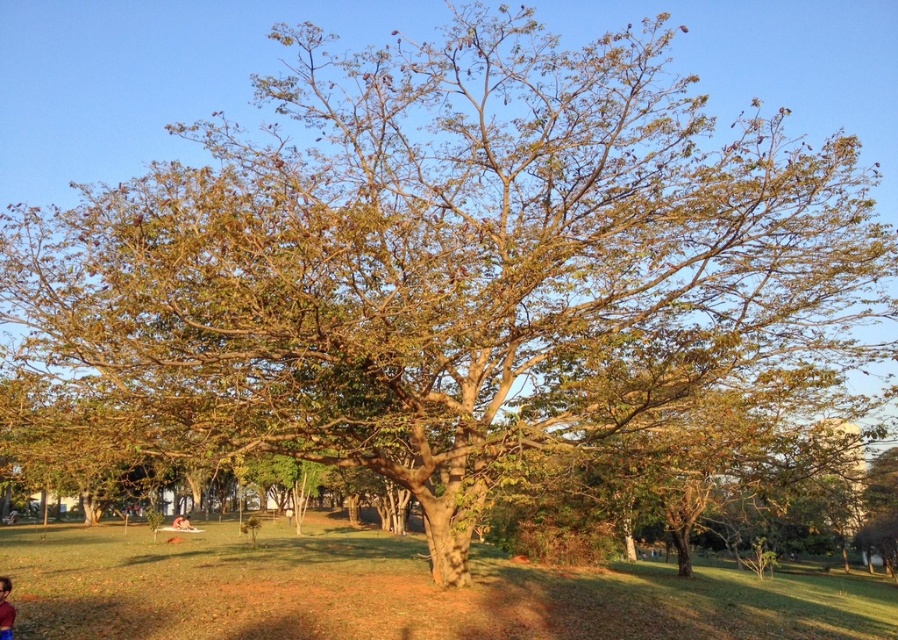
You are a photographer standing in front of the large tree. You notice a person wearing a red shirt at lower left and another person with light brown skin at lower center. Which person is closer to you?

The red shirt at lower left is closer to the viewer than light brown skin at lower center.

You are standing in a park and see a person wearing a red shirt at lower left and another person with light brown skin at lower center. Which person is positioned higher in the image?

The red shirt at lower left is positioned higher than the light brown skin at lower center in the image.

You are a photographer standing in the park and see a person wearing a red shirt at lower left and another person with light brown skin at lower center. Which person is more to the left?

The light brown skin at lower center is more to the left than the red shirt at lower left.